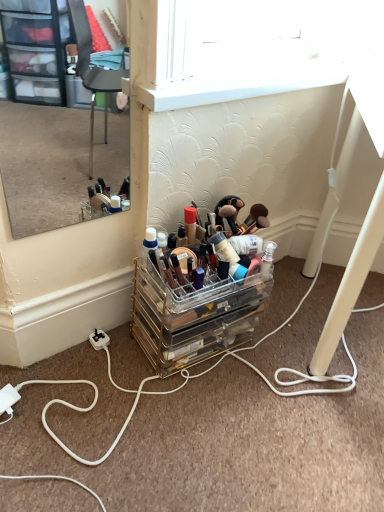
At what (x,y) coordinates should I click in order to perform the action: click on vacant space to the right of white plastic power outlet at lower left. Please return your answer as a coordinate pair (x, y). The image size is (384, 512). Looking at the image, I should click on (138, 360).